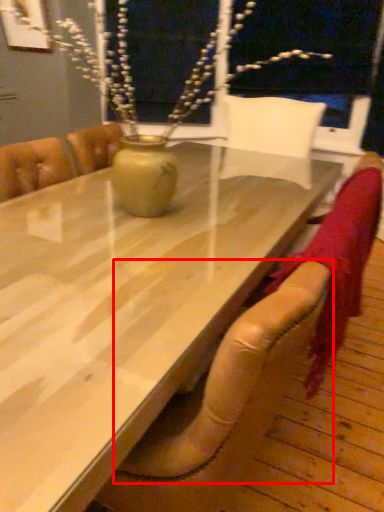
Question: From the image's perspective, where is armchair (annotated by the red box) located in relation to table in the image?

Choices:
 (A) above
 (B) below

Answer: (B)